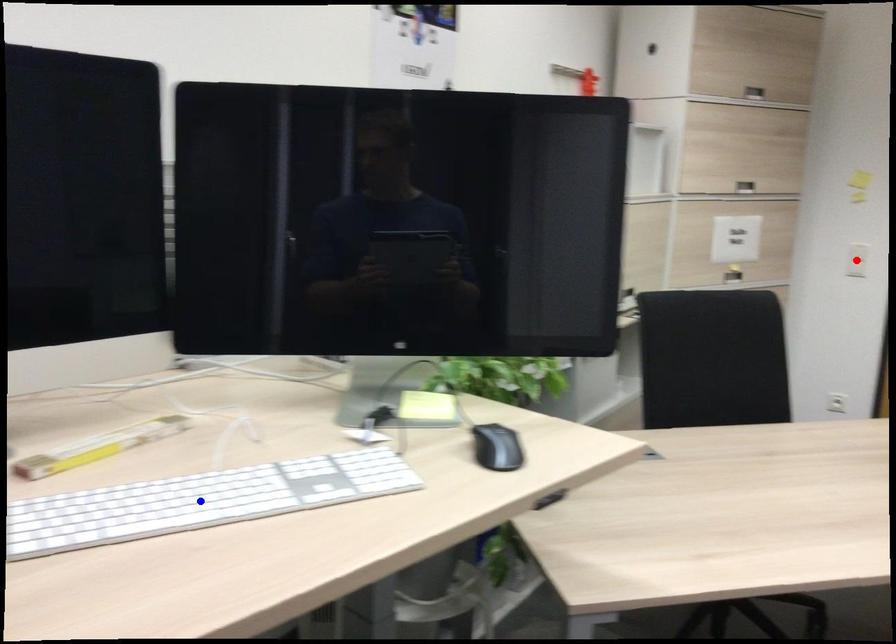
Question: In the image, two points are highlighted. Which point is nearer to the camera? Reply with the corresponding letter.

Choices:
 (A) blue point
 (B) red point

Answer: (A)